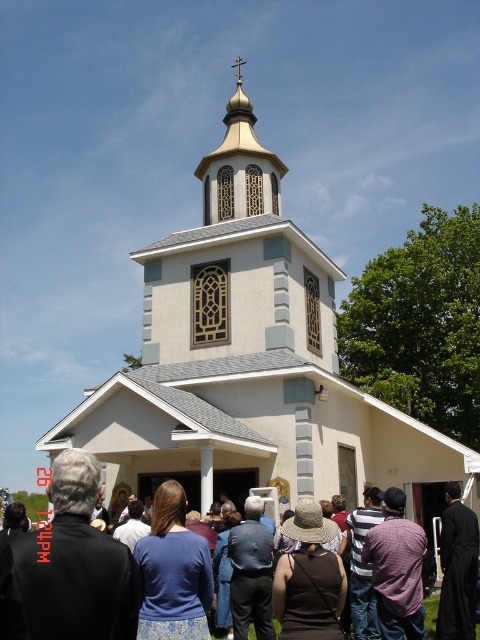
You are standing in front of the church and want to take a photo of both the brown fabric crowd at center and the gold textured dome at upper center. Which object will appear larger in the photo?

The brown fabric crowd at center will appear larger in the photo because it is closer to the viewer than the gold textured dome at upper center.

You are standing in the outdoor area looking towards the church. Which object, the white stucco church at center or the gold textured dome at upper center, is closer to you?

The white stucco church at center is closer to you because it is in front of the gold textured dome at upper center.

What are the coordinates of the white stucco church at center?

The white stucco church at center is located at coordinates point [249,364].